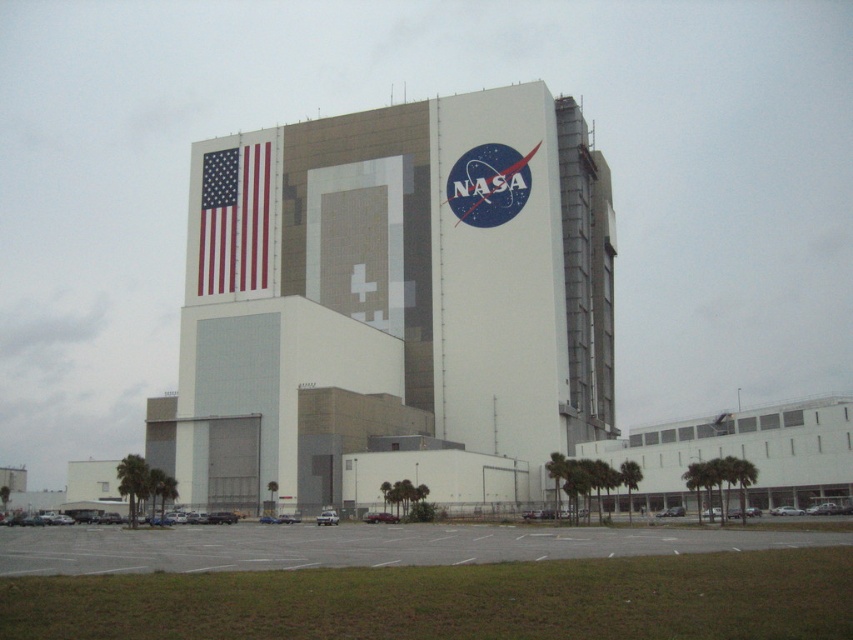
Does white concrete building at center have a lesser width compared to matte fabric flag at upper left?

No, white concrete building at center is not thinner than matte fabric flag at upper left.

This screenshot has height=640, width=853. In order to click on white concrete building at center in this screenshot , I will do `click(393, 305)`.

Does point (378, 291) come behind point (215, 154)?

That is False.

Locate an element on the screen. The width and height of the screenshot is (853, 640). white concrete building at center is located at coordinates (393, 305).